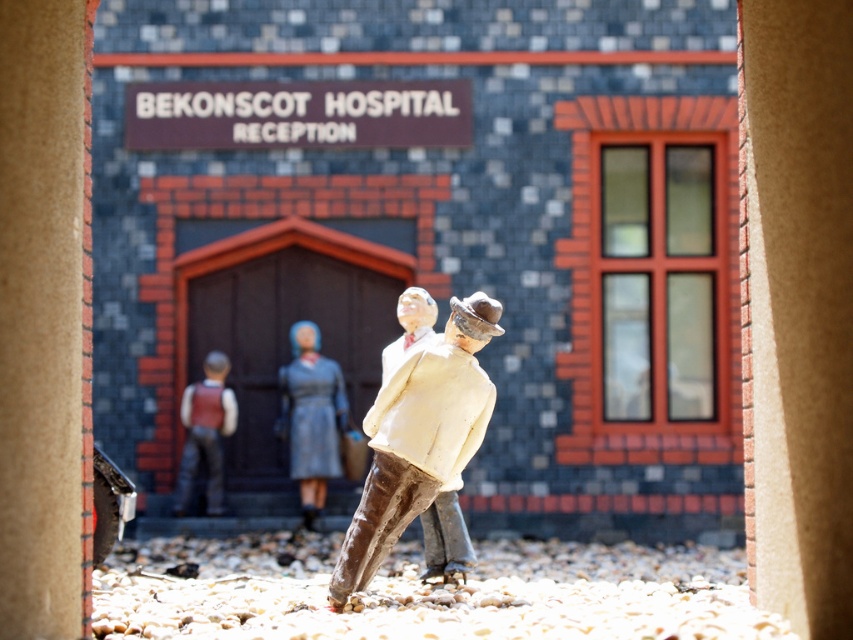
Question: Is the position of matte gray dress at center more distant than that of matte brown vest at center?

Choices:
 (A) yes
 (B) no

Answer: (B)

Question: Does matte gray dress at center appear on the left side of brown leather boot at center?

Choices:
 (A) yes
 (B) no

Answer: (A)

Question: Is matte gray dress at center bigger than brown leather boot at center?

Choices:
 (A) yes
 (B) no

Answer: (A)

Question: Which point is farther to the camera?

Choices:
 (A) white painted wood figure at center
 (B) brown leather boot at center

Answer: (B)

Question: Which point appears farthest from the camera in this image?

Choices:
 (A) (378, 531)
 (B) (218, 448)

Answer: (B)

Question: Which of the following is the closest to the observer?

Choices:
 (A) (387, 472)
 (B) (445, 477)

Answer: (A)